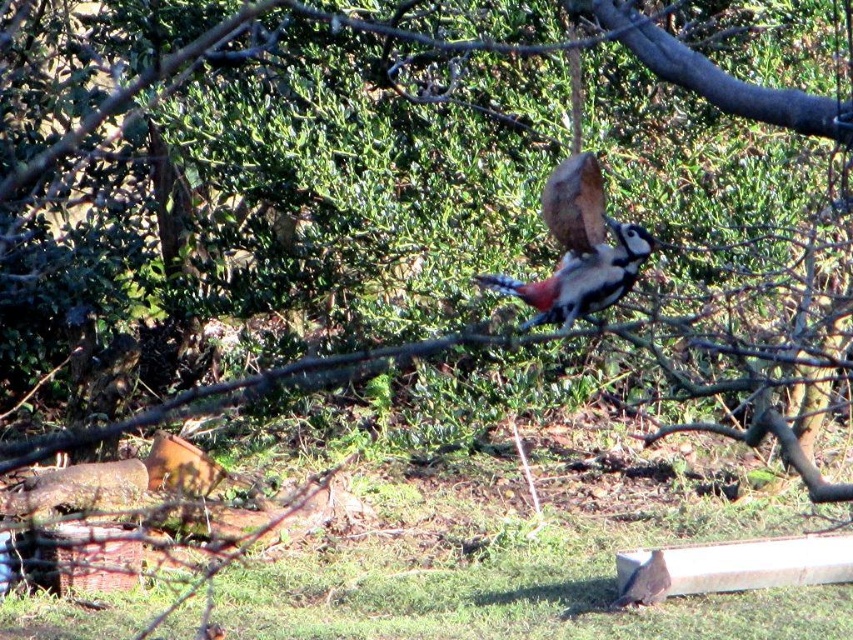
Where is `speckled brown woodpecker at center`? This screenshot has height=640, width=853. speckled brown woodpecker at center is located at coordinates (582, 276).

Can you confirm if speckled brown woodpecker at center is wider than speckled brown bird at center?

Yes, speckled brown woodpecker at center is wider than speckled brown bird at center.

Which is in front, point (526, 282) or point (659, 570)?

Point (526, 282) is in front.

Image resolution: width=853 pixels, height=640 pixels. I want to click on speckled brown woodpecker at center, so [582, 276].